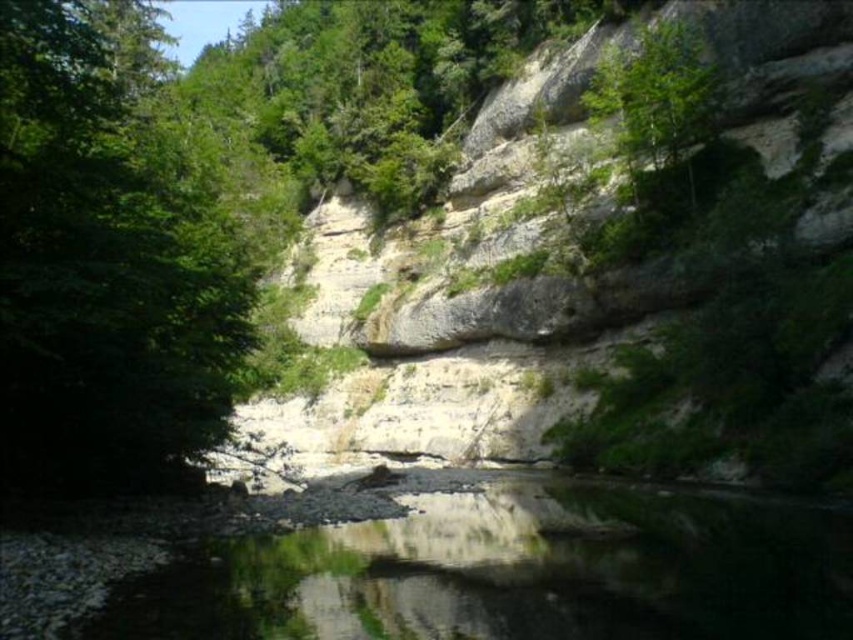
In the scene shown: Does green reflective water at center appear on the right side of green leafy tree at upper center?

No, green reflective water at center is not to the right of green leafy tree at upper center.

Measure the distance between point (572,596) and camera.

Point (572,596) is 33.54 meters away from camera.

The image size is (853, 640). In order to click on green reflective water at center in this screenshot , I will do `click(514, 572)`.